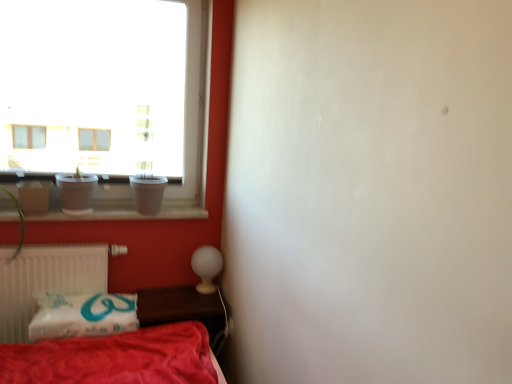
Question: Does point (50, 244) appear closer or farther from the camera than point (185, 316)?

Choices:
 (A) closer
 (B) farther

Answer: (B)

Question: From the image's perspective, relative to wooden table at lower center, is white plastic radiator at lower left above or below?

Choices:
 (A) above
 (B) below

Answer: (A)

Question: Estimate the real-world distances between objects in this image. Which object is farther from the transparent glass vase at left?

Choices:
 (A) wooden table at lower center
 (B) white plastic radiator at lower left
 (C) red cotton blanket at lower left
 (D) green matte plant at left
 (E) white glossy table lamp at lower center

Answer: (E)

Question: Considering the real-world distances, which object is farthest from the transparent glass window at upper left?

Choices:
 (A) white plastic radiator at lower left
 (B) wooden table at lower center
 (C) transparent glass vase at left
 (D) green matte plant at left
 (E) red cotton blanket at lower left

Answer: (B)